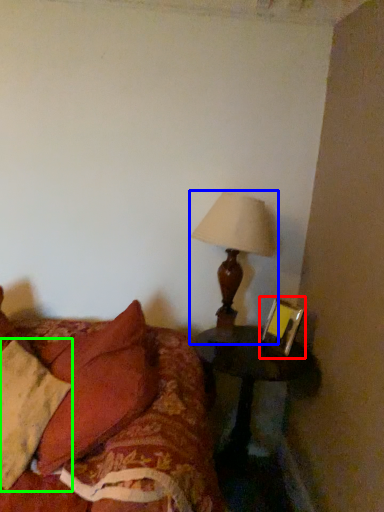
Question: Considering the real-world distances, which object is closest to picture frame (highlighted by a red box)? lamp (highlighted by a blue box) or pillow (highlighted by a green box).

Choices:
 (A) lamp
 (B) pillow

Answer: (A)